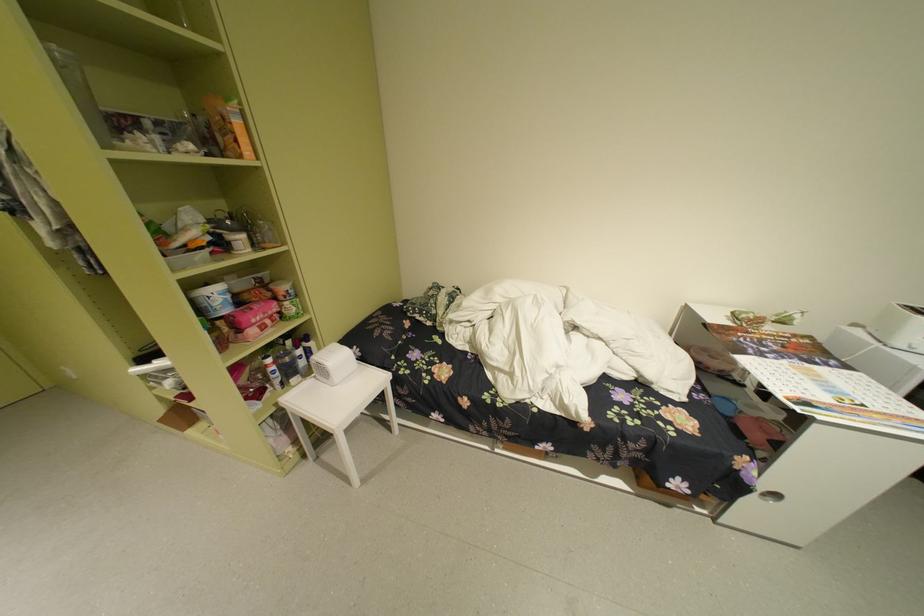
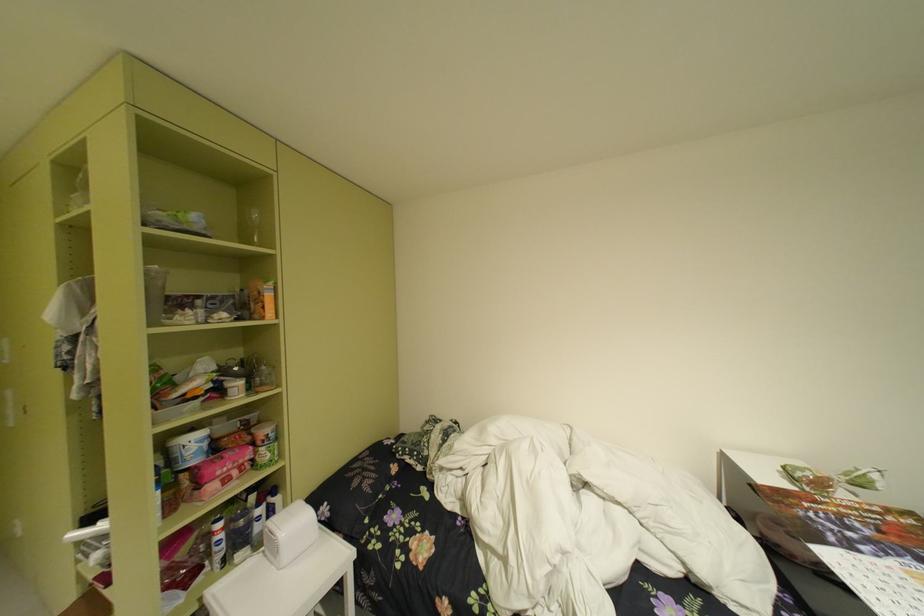
Find the pixel in the second image that matches [285,363] in the first image.

(235, 528)